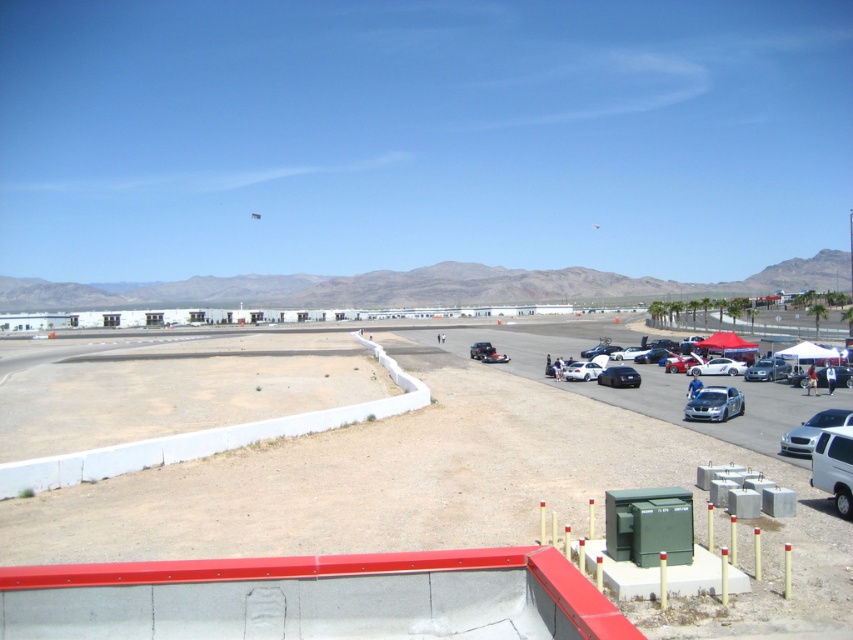
Can you confirm if white glossy sedan at lower right is thinner than shiny silver sedan at lower right?

No.

Does point (821, 417) come in front of point (769, 356)?

Yes.

What are the coordinates of `white glossy sedan at lower right` in the screenshot? It's located at (813, 429).

Who is taller, white glossy sedan at lower right or white glossy car at lower right?

white glossy sedan at lower right is taller.

Can you confirm if white glossy sedan at lower right is bigger than white glossy car at lower right?

Yes.

Who is more distant from viewer, (843, 422) or (691, 369)?

Positioned behind is point (691, 369).

Locate an element on the screen. This screenshot has height=640, width=853. white glossy sedan at lower right is located at coordinates (813, 429).

Can you confirm if white matte car at center is positioned to the right of shiny silver car at center right?

In fact, white matte car at center is to the left of shiny silver car at center right.

Image resolution: width=853 pixels, height=640 pixels. Describe the element at coordinates (581, 371) in the screenshot. I see `white matte car at center` at that location.

Is point (566, 380) less distant than point (668, 355)?

Yes, point (566, 380) is closer to viewer.

Identify the location of white matte car at center. This screenshot has height=640, width=853. (581, 371).